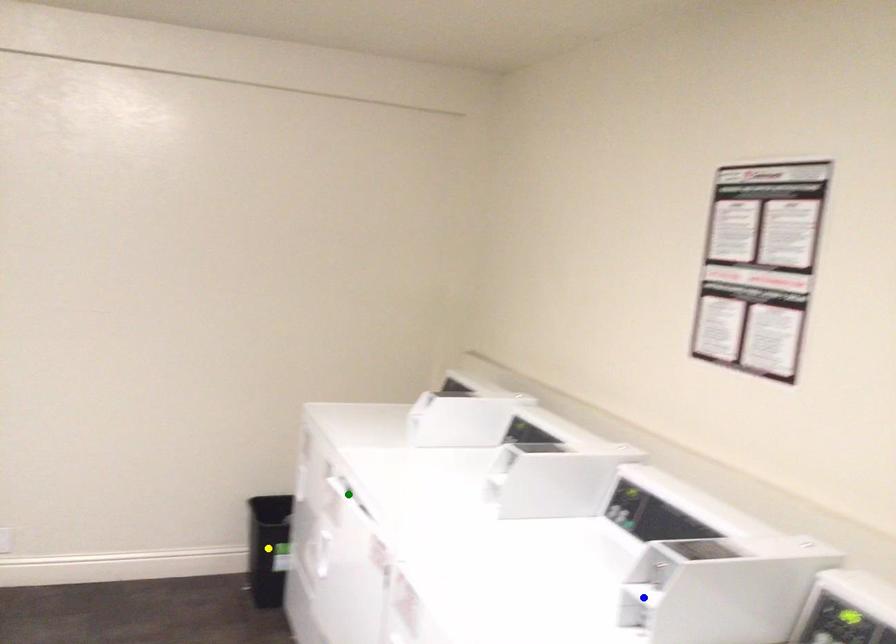
Order these from nearest to farthest:
blue point | yellow point | green point

blue point → green point → yellow point